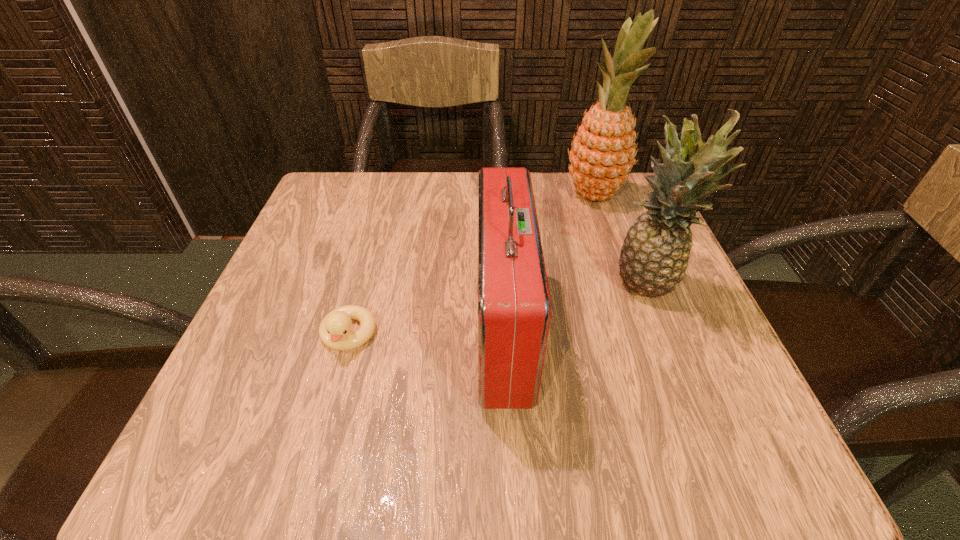
Identify the location of vacant space at the left edge of the desktop. (311, 328).

In order to click on blank space at the right edge in this screenshot , I will do `click(606, 286)`.

Image resolution: width=960 pixels, height=540 pixels. What are the coordinates of `vacant area at the far left corner` in the screenshot? It's located at tap(353, 226).

Where is `free space at the far right corner`? free space at the far right corner is located at coordinates (593, 215).

The height and width of the screenshot is (540, 960). In order to click on free space between the leftmost object and the farthest object in this screenshot , I will do `click(471, 265)`.

Where is `free space between the duckling and the tallest object`? The image size is (960, 540). free space between the duckling and the tallest object is located at coordinates (471, 265).

Where is `free area in between the second shortest object and the farthest object`? The height and width of the screenshot is (540, 960). free area in between the second shortest object and the farthest object is located at coordinates (549, 263).

I want to click on free space between the first-aid kit and the leftmost object, so click(x=425, y=333).

The height and width of the screenshot is (540, 960). I want to click on free spot between the third shortest object and the taller pineapple, so click(x=621, y=241).

I want to click on vacant space in between the shortest object and the third tallest object, so click(425, 333).